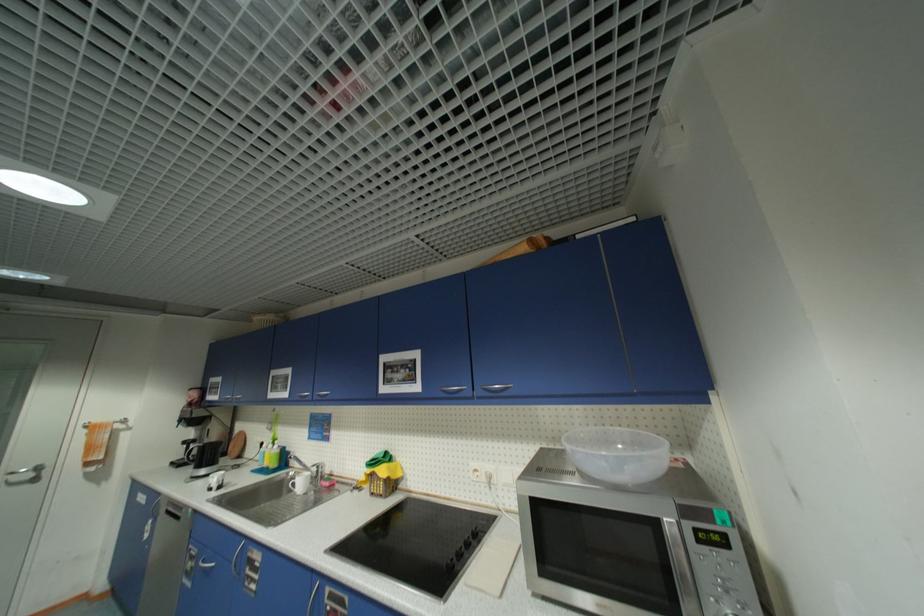
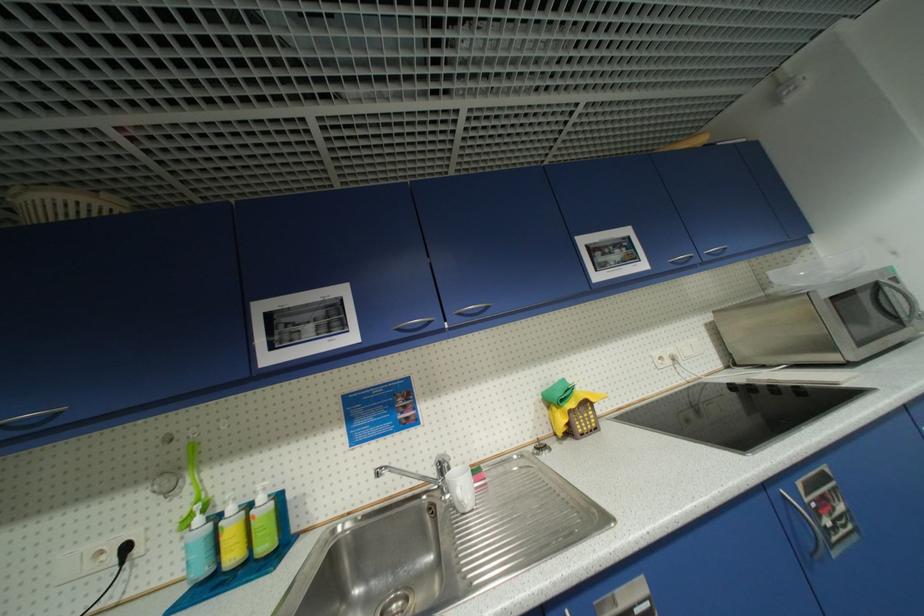
The point at (323, 395) is marked in the first image. Where is the corresponding point in the second image?

(466, 315)